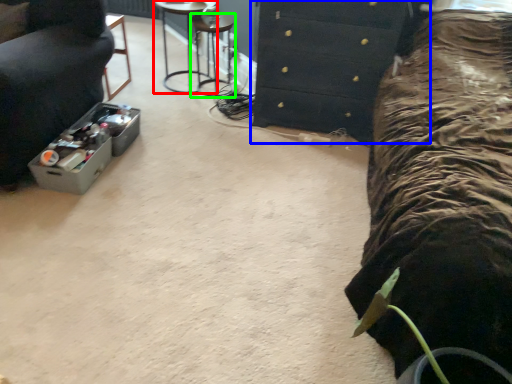
Question: Which object is positioned closest to furniture (highlighted by a red box)? Select from chest of drawers (highlighted by a blue box) and bar stool (highlighted by a green box).

Choices:
 (A) chest of drawers
 (B) bar stool

Answer: (B)